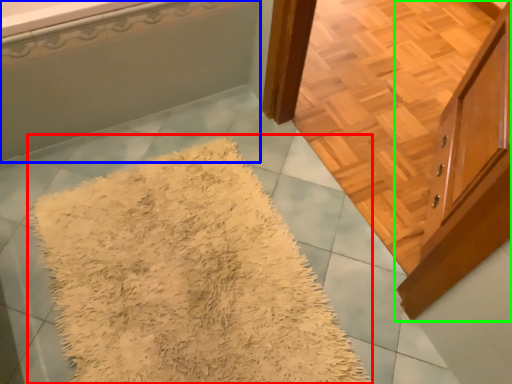
Question: Which object is positioned farthest from mat (highlighted by a red box)? Select from bathtub (highlighted by a blue box) and cabinetry (highlighted by a green box).

Choices:
 (A) bathtub
 (B) cabinetry

Answer: (B)